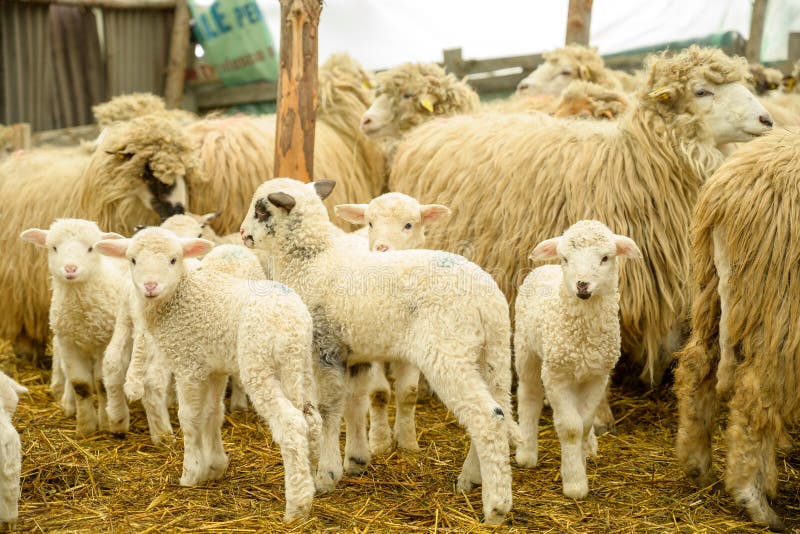
What are the coordinates of `beam` in the screenshot? It's located at (282, 73), (578, 22).